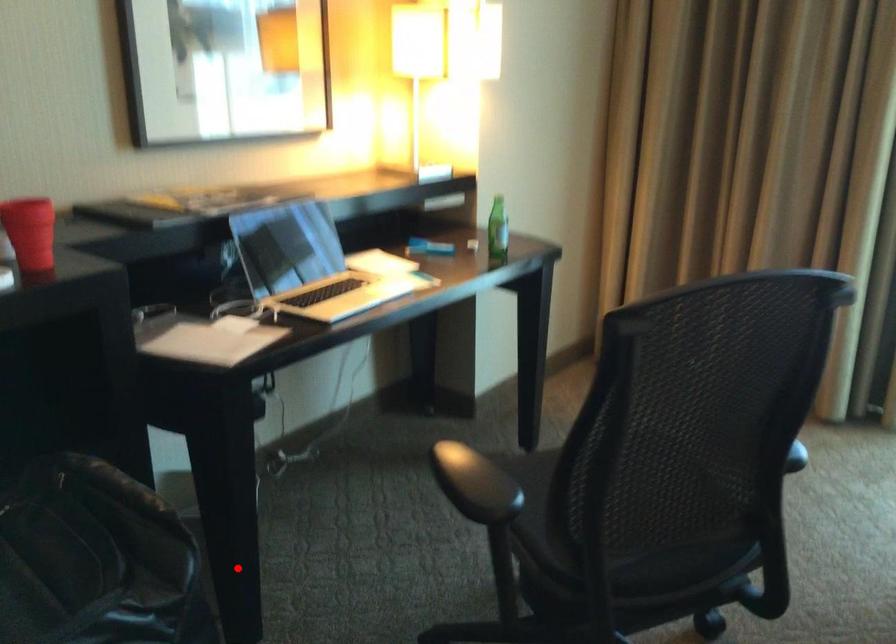
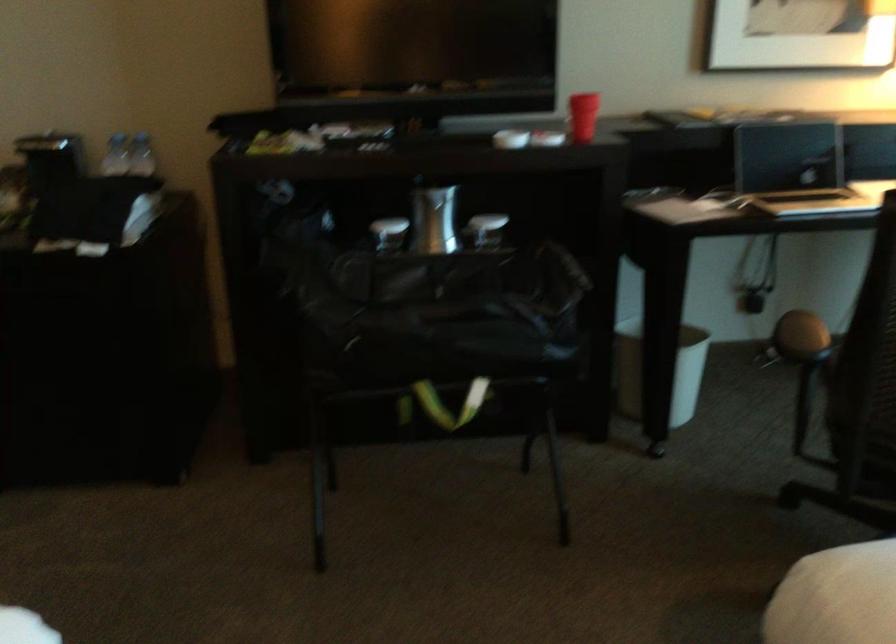
Find the pixel in the second image that matches the highlighted location in the first image.

(659, 371)